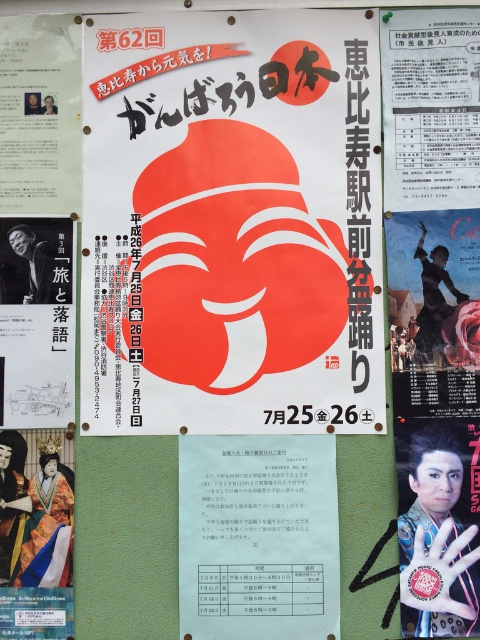
Question: Is matte red mask at center positioned before white paper at center?

Choices:
 (A) no
 (B) yes

Answer: (A)

Question: Which point is farther to the camera?

Choices:
 (A) white paper at center
 (B) matte red mask at center

Answer: (B)

Question: Does matte red mask at center appear on the right side of white paper at center?

Choices:
 (A) no
 (B) yes

Answer: (A)

Question: Which point is closer to the camera?

Choices:
 (A) (135, 404)
 (B) (332, 499)

Answer: (B)

Question: Does matte red mask at center have a greater width compared to white paper at center?

Choices:
 (A) no
 (B) yes

Answer: (B)

Question: Which of the following is the farthest from the observer?

Choices:
 (A) white paper at center
 (B) matte red mask at center

Answer: (B)